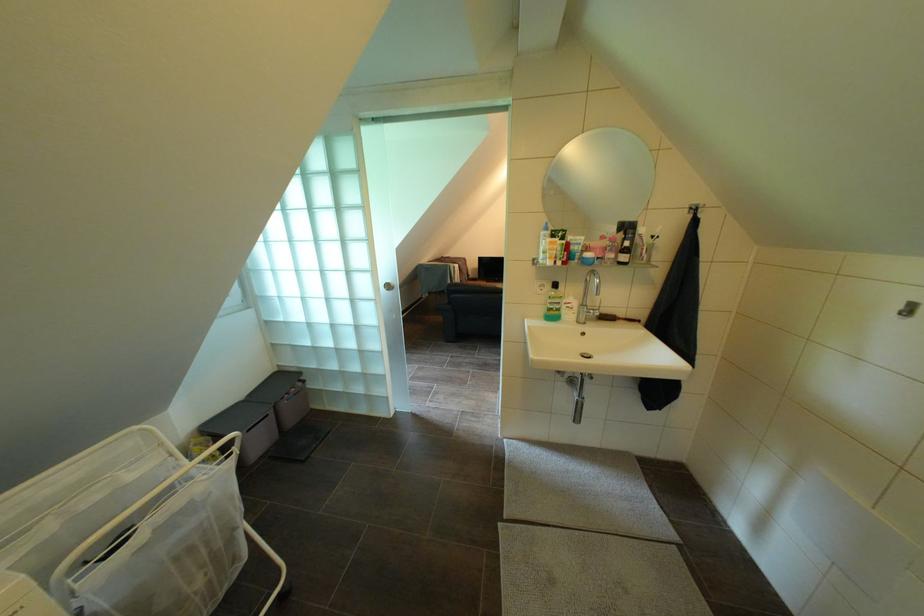
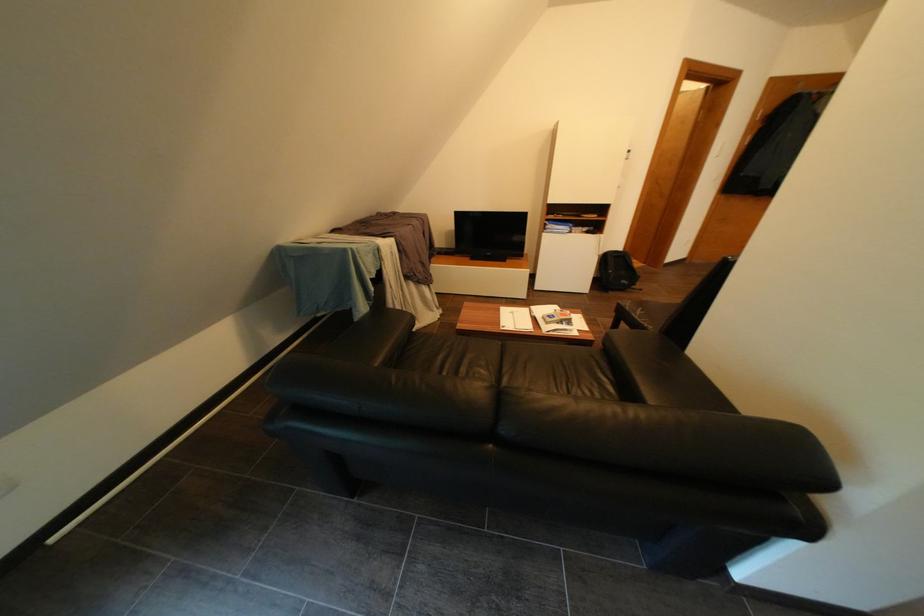
Question: Which direction would the cameraman need to move to produce the second image? Reply with the corresponding letter.

Choices:
 (A) Left
 (B) Right
 (C) Forward
 (D) Backward

Answer: (C)